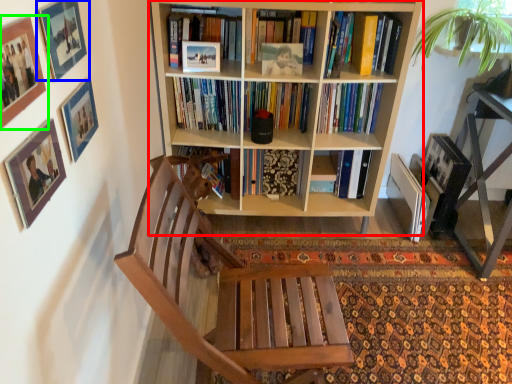
Question: Estimate the real-world distances between objects in this image. Which object is closer to bookcase (highlighted by a red box), picture frame (highlighted by a blue box) or picture frame (highlighted by a green box)?

Choices:
 (A) picture frame
 (B) picture frame

Answer: (A)